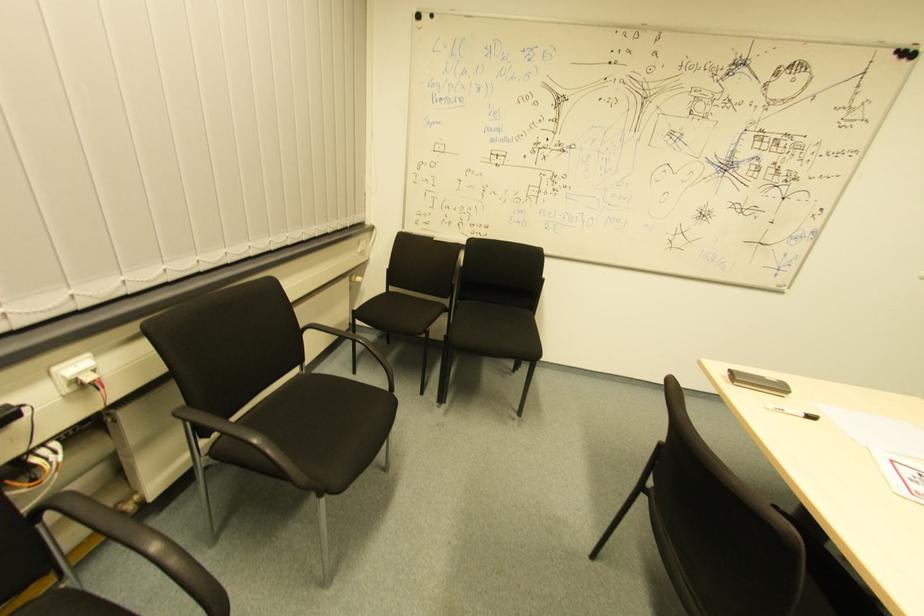
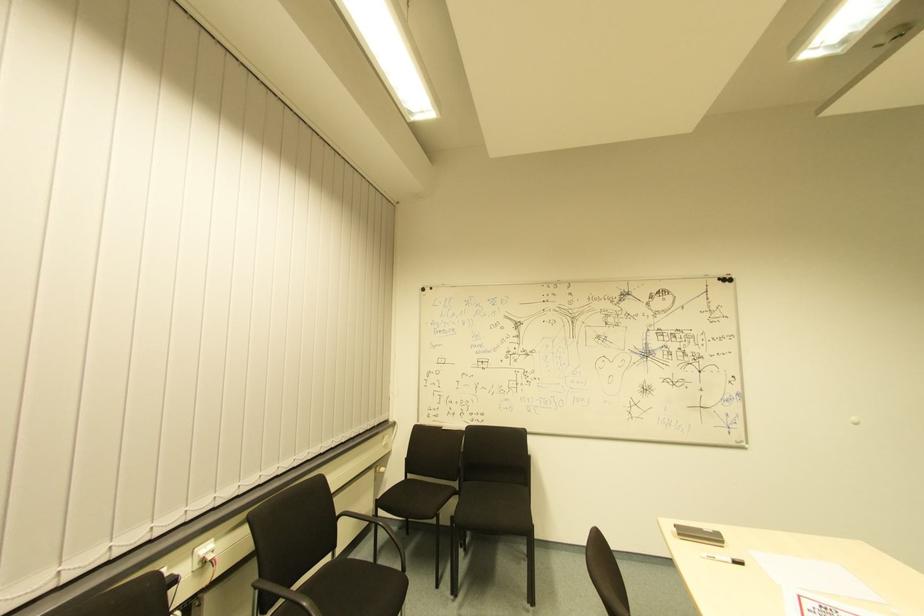
The point at [89,379] is marked in the first image. Where is the corresponding point in the second image?

(208, 561)